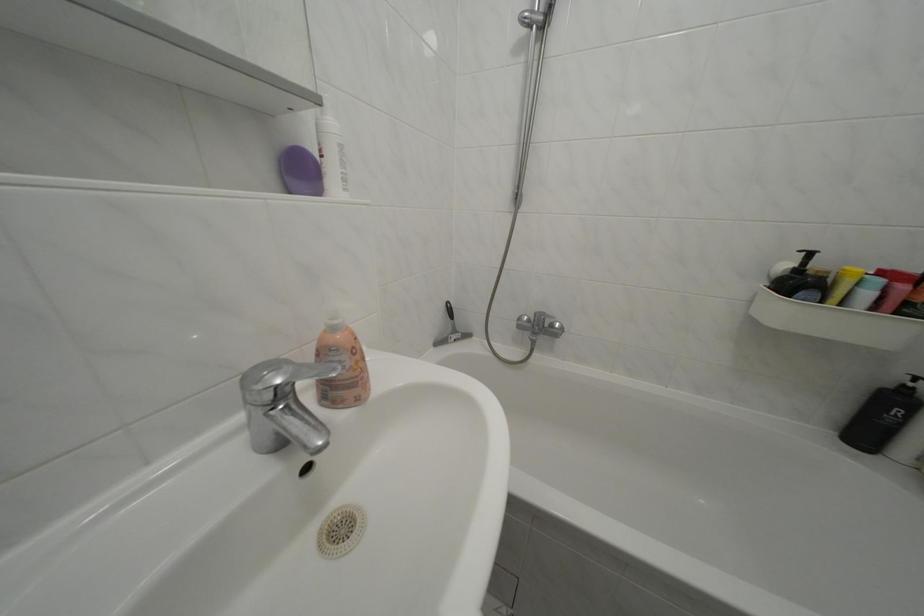
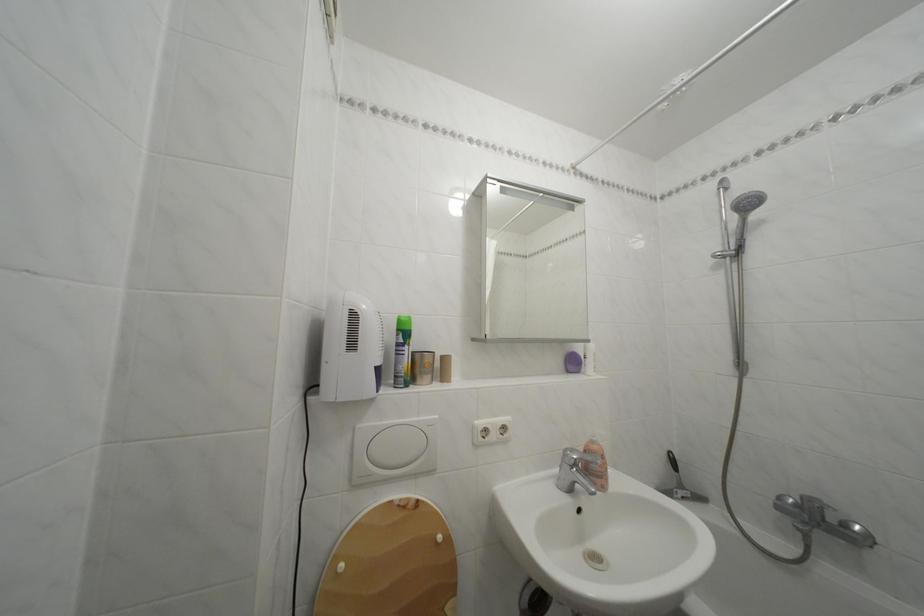
Locate, in the second image, the point that corresponds to point (538, 328) in the first image.

(806, 512)